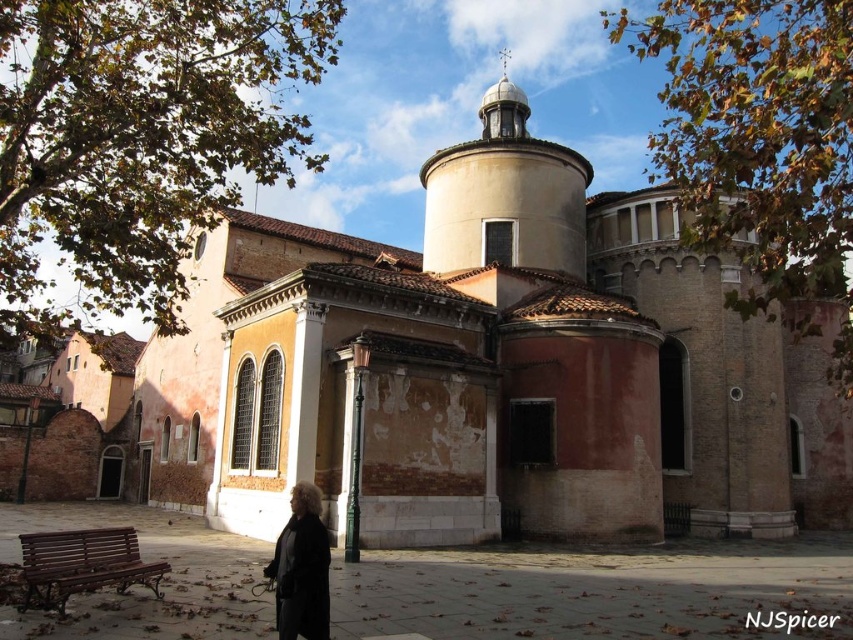
Can you confirm if smooth white dome at upper center is thinner than wooden bench at lower left?

Incorrect, smooth white dome at upper center's width is not less than wooden bench at lower left's.

The height and width of the screenshot is (640, 853). I want to click on smooth white dome at upper center, so click(505, 195).

Identify the location of smooth white dome at upper center. The height and width of the screenshot is (640, 853). (505, 195).

Identify the location of smooth white dome at upper center. (505, 195).

Is wooden bench at lower left to the right of black wool coat at lower left from the viewer's perspective?

In fact, wooden bench at lower left is to the left of black wool coat at lower left.

Is wooden bench at lower left behind black wool coat at lower left?

That is True.

Which is in front, point (51, 580) or point (322, 531)?

Point (322, 531) is in front.

Image resolution: width=853 pixels, height=640 pixels. I want to click on wooden bench at lower left, so click(83, 564).

Is smooth white dome at upper center bigger than black wool coat at lower left?

Yes.

Which is more to the left, smooth white dome at upper center or black wool coat at lower left?

From the viewer's perspective, black wool coat at lower left appears more on the left side.

Who is more distant from viewer, (576, 252) or (300, 618)?

Positioned behind is point (576, 252).

The height and width of the screenshot is (640, 853). I want to click on smooth white dome at upper center, so click(505, 195).